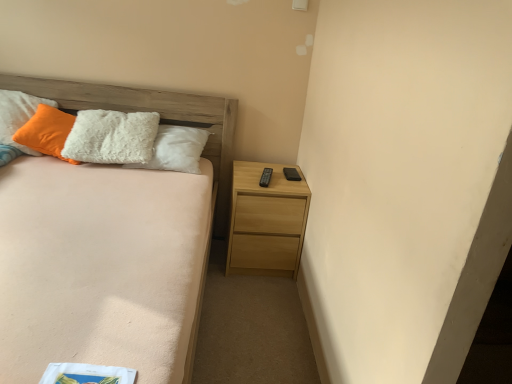
Question: Is white fluffy pillow at upper left positioned before light brown wooden bed at left?

Choices:
 (A) no
 (B) yes

Answer: (A)

Question: Is white fluffy pillow at upper left outside of light brown wooden bed at left?

Choices:
 (A) no
 (B) yes

Answer: (A)

Question: Is light brown wooden bed at left surrounded by white fluffy pillow at upper left?

Choices:
 (A) yes
 (B) no

Answer: (B)

Question: Is white fluffy pillow at upper left positioned with its back to light brown wooden bed at left?

Choices:
 (A) no
 (B) yes

Answer: (B)

Question: Is there a large distance between white fluffy pillow at upper left and light brown wooden bed at left?

Choices:
 (A) yes
 (B) no

Answer: (B)

Question: Considering the positions of light wood nightstand at lower right and light brown wooden bed at left in the image, is light wood nightstand at lower right bigger or smaller than light brown wooden bed at left?

Choices:
 (A) big
 (B) small

Answer: (B)

Question: Relative to light brown wooden bed at left, is light wood nightstand at lower right in front or behind?

Choices:
 (A) front
 (B) behind

Answer: (B)

Question: Considering the positions of light wood nightstand at lower right and light brown wooden bed at left in the image, is light wood nightstand at lower right wider or thinner than light brown wooden bed at left?

Choices:
 (A) thin
 (B) wide

Answer: (A)

Question: Considering the positions of point (268, 235) and point (218, 183), is point (268, 235) closer or farther from the camera than point (218, 183)?

Choices:
 (A) farther
 (B) closer

Answer: (B)

Question: Considering their positions, is light brown wooden bed at left located in front of or behind white fluffy pillow at upper left?

Choices:
 (A) front
 (B) behind

Answer: (A)

Question: Is light brown wooden bed at left wider or thinner than white fluffy pillow at upper left?

Choices:
 (A) thin
 (B) wide

Answer: (B)

Question: From the image's perspective, is light brown wooden bed at left positioned above or below white fluffy pillow at upper left?

Choices:
 (A) below
 (B) above

Answer: (A)

Question: From their relative heights in the image, would you say light brown wooden bed at left is taller or shorter than white fluffy pillow at upper left?

Choices:
 (A) tall
 (B) short

Answer: (A)

Question: Considering the positions of light brown wooden bed at left and light wood nightstand at lower right in the image, is light brown wooden bed at left wider or thinner than light wood nightstand at lower right?

Choices:
 (A) thin
 (B) wide

Answer: (B)

Question: Considering their positions, is light brown wooden bed at left located in front of or behind light wood nightstand at lower right?

Choices:
 (A) behind
 (B) front

Answer: (B)